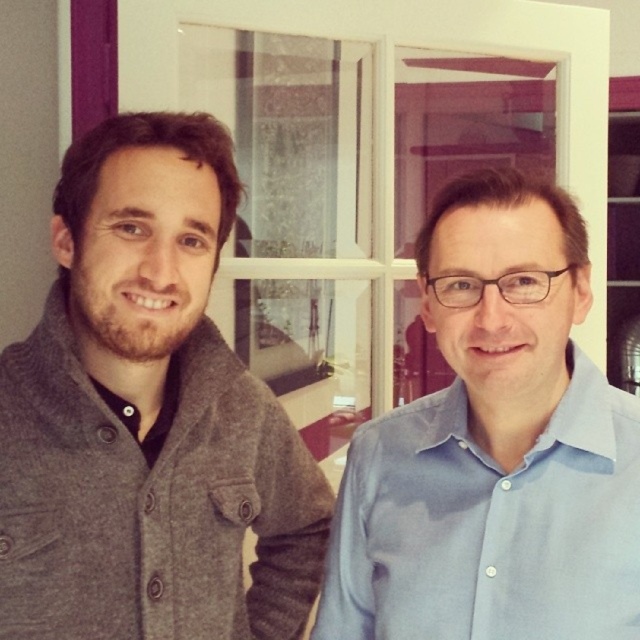
Question: Does gray woolen sweater at left have a lesser width compared to light blue cotton shirt at right?

Choices:
 (A) no
 (B) yes

Answer: (B)

Question: Which point is closer to the camera?

Choices:
 (A) light blue cotton shirt at right
 (B) gray woolen sweater at left

Answer: (A)

Question: Does gray woolen sweater at left lie in front of light blue cotton shirt at right?

Choices:
 (A) yes
 (B) no

Answer: (B)

Question: Among these objects, which one is nearest to the camera?

Choices:
 (A) gray woolen sweater at left
 (B) light blue cotton shirt at right

Answer: (B)

Question: Which point appears closest to the camera in this image?

Choices:
 (A) (356, 508)
 (B) (266, 445)

Answer: (A)

Question: Can you confirm if gray woolen sweater at left is positioned to the right of light blue cotton shirt at right?

Choices:
 (A) yes
 (B) no

Answer: (B)